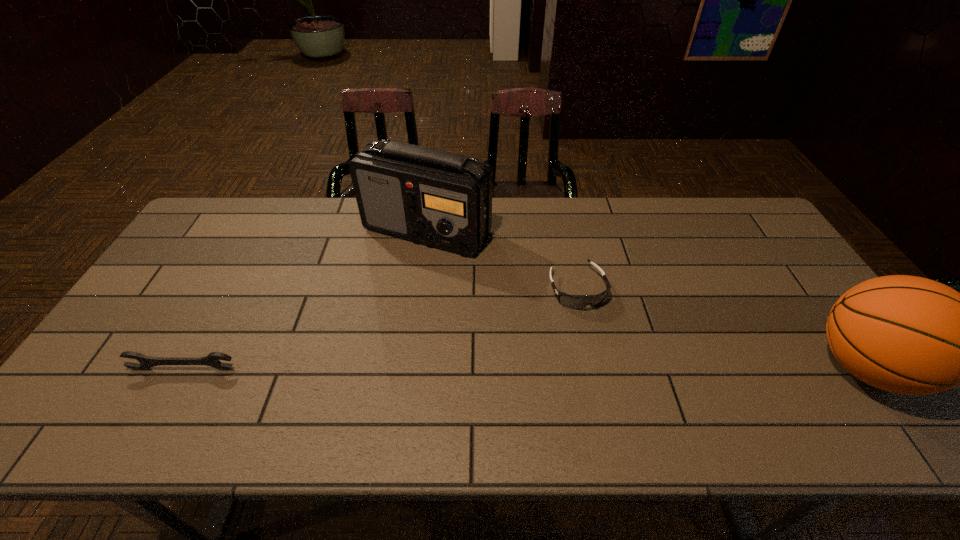
Locate which object ranks third in proximity to the wrench. Please provide its 2D coordinates. Your answer should be formatted as a tuple, i.e. [(x, y)], where the tuple contains the x and y coordinates of a point satisfying the conditions above.

[(909, 335)]